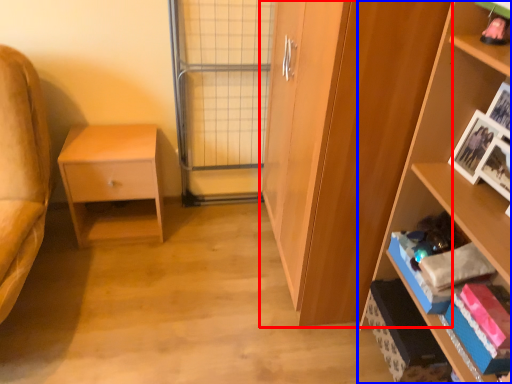
Question: Which object appears closest to the camera in this image, cabinetry (highlighted by a red box) or shelf (highlighted by a blue box)?

Choices:
 (A) cabinetry
 (B) shelf

Answer: (B)